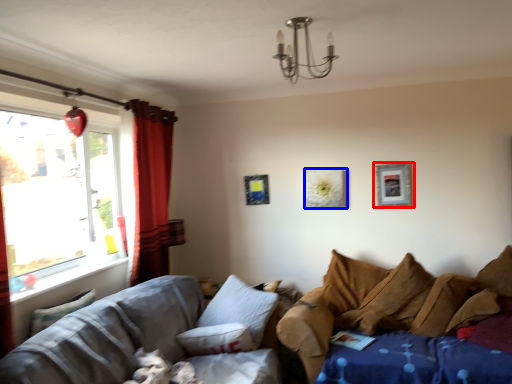
Question: Which object appears closest to the camera in this image, picture frame (highlighted by a red box) or picture frame (highlighted by a blue box)?

Choices:
 (A) picture frame
 (B) picture frame

Answer: (A)